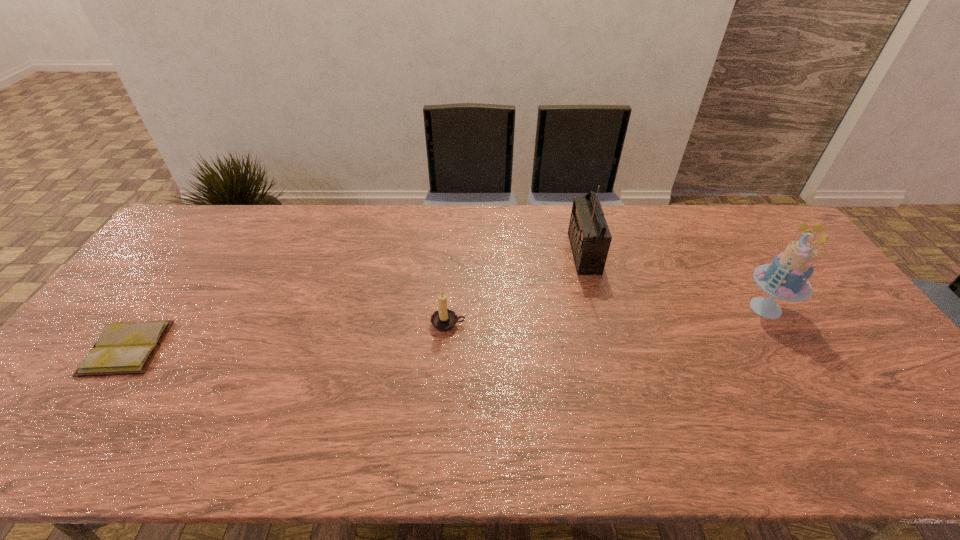
Image resolution: width=960 pixels, height=540 pixels. Find the location of `radio receiver`. radio receiver is located at coordinates (589, 235).

This screenshot has width=960, height=540. What are the coordinates of `the third object from left to right` in the screenshot? It's located at (589, 235).

You are a GUI agent. You are given a task and a screenshot of the screen. Output one action in this format:
    pyautogui.click(x=<x>, y=<y>)
    Task: Click on the cake
    Image resolution: width=960 pixels, height=540 pixels.
    Given the screenshot: What is the action you would take?
    pyautogui.click(x=786, y=277)

Where is `candle holder`? candle holder is located at coordinates (443, 319).

Identify the location of the third object from right to left. Image resolution: width=960 pixels, height=540 pixels. (443, 319).

You are a GUI agent. You are given a task and a screenshot of the screen. Output one action in this format:
    pyautogui.click(x=<x>, y=<y>)
    Task: Click on the shortest object
    
    Given the screenshot: What is the action you would take?
    pyautogui.click(x=122, y=348)

Identify the location of diary. (122, 348).

Image resolution: width=960 pixels, height=540 pixels. Find the location of `vacant space positioned on the front panel of the third object from left to right`. vacant space positioned on the front panel of the third object from left to right is located at coordinates tap(553, 253).

The width and height of the screenshot is (960, 540). Find the location of `free spot located 0.330m on the front panel of the third object from left to right`. free spot located 0.330m on the front panel of the third object from left to right is located at coordinates (470, 253).

Where is `vacant space situated on the front panel of the third object from left to right`? The image size is (960, 540). vacant space situated on the front panel of the third object from left to right is located at coordinates (525, 253).